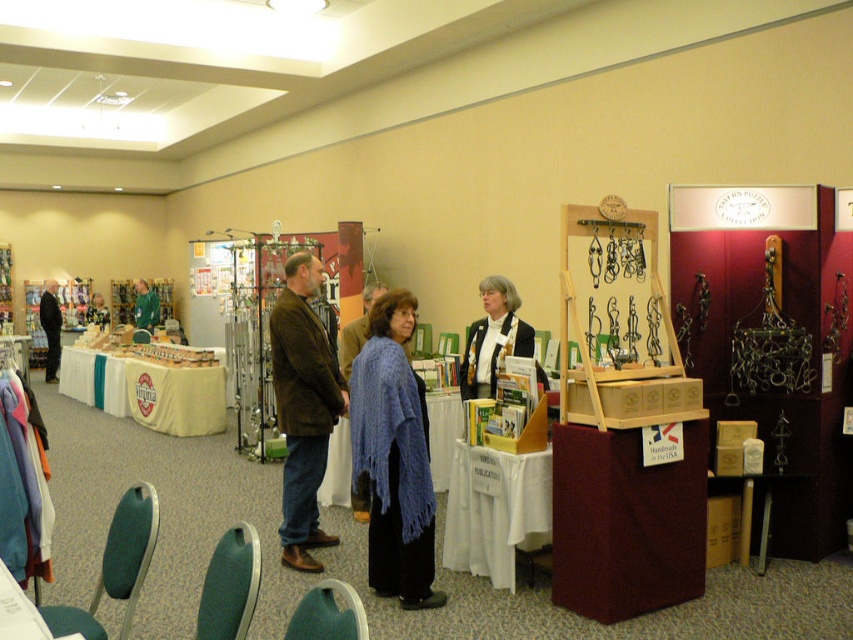
Question: Which point is farther to the camera?

Choices:
 (A) (154, 323)
 (B) (51, 369)

Answer: (A)

Question: In this image, where is white cloth-covered table at center located relative to dark brown leather jacket at left?

Choices:
 (A) below
 (B) above

Answer: (A)

Question: Does beige fabric table at lower left have a larger size compared to dark brown leather jacket at left?

Choices:
 (A) no
 (B) yes

Answer: (B)

Question: Which point is farther to the camera?

Choices:
 (A) (138, 285)
 (B) (451, 433)
 (C) (293, 520)
 (D) (418, 458)

Answer: (A)

Question: Which of the following is the farthest from the observer?

Choices:
 (A) (496, 460)
 (B) (432, 419)
 (C) (495, 307)

Answer: (B)

Question: In this image, where is blue knitted shawl at center located relative to white cloth-covered table at center?

Choices:
 (A) below
 (B) above

Answer: (B)